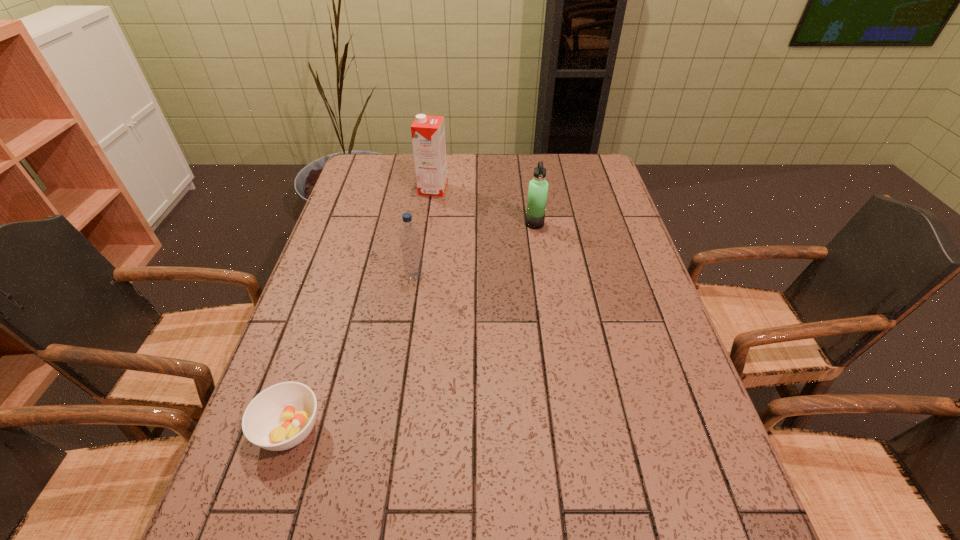
This screenshot has width=960, height=540. I want to click on the tallest object, so 428,132.

The image size is (960, 540). I want to click on carton, so click(x=428, y=132).

Identify the location of the rightmost object. (538, 187).

This screenshot has width=960, height=540. I want to click on the second farthest object, so (x=538, y=187).

You are a GUI agent. You are given a task and a screenshot of the screen. Output one action in this format:
    pyautogui.click(x=<x>, y=<y>)
    Task: Click on the second nearest object
    
    Given the screenshot: What is the action you would take?
    pyautogui.click(x=410, y=243)

Locate an element on the screen. This screenshot has height=540, width=960. the leftmost object is located at coordinates (280, 417).

Where is `the shortest object`? The width and height of the screenshot is (960, 540). the shortest object is located at coordinates (280, 417).

You are a GUI agent. You are given a task and a screenshot of the screen. Output one action in this format:
    pyautogui.click(x=<x>, y=<y>)
    Task: Click on the vacant position located on the right of the tallest object
    This screenshot has width=960, height=540.
    Given the screenshot: What is the action you would take?
    pyautogui.click(x=468, y=189)

The width and height of the screenshot is (960, 540). What are the coordinates of `free spot located 0.390m on the back of the rightmost object` in the screenshot? It's located at (525, 157).

Find the location of `vacant space positioned on the front of the second nearest object`. vacant space positioned on the front of the second nearest object is located at coordinates (412, 296).